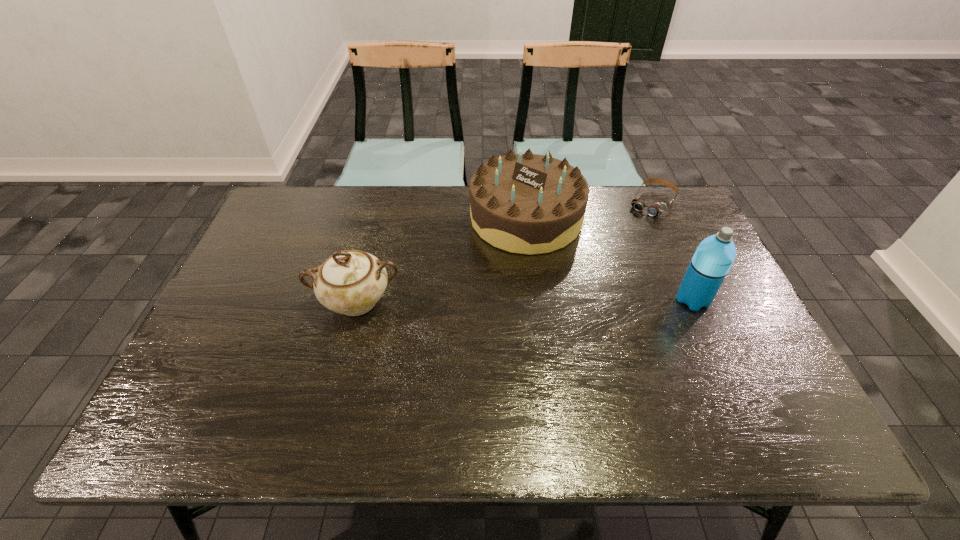
In the image, there is a desktop. Where is `vacant space at the far left corner`? The width and height of the screenshot is (960, 540). vacant space at the far left corner is located at coordinates (305, 218).

Image resolution: width=960 pixels, height=540 pixels. I want to click on free space at the far right corner of the desktop, so click(x=661, y=215).

Identify the location of blank region between the tallest object and the shortest object. The image size is (960, 540). (672, 251).

Locate an element on the screen. This screenshot has height=540, width=960. free spot between the leftmost object and the tallest object is located at coordinates (524, 301).

Identify the location of free space between the birthday cake and the shortest object. [x=588, y=210].

Locate an element on the screen. vacant area that lies between the third object from right to left and the shortest object is located at coordinates (588, 210).

The image size is (960, 540). In order to click on free spot between the leftmost object and the second object from left to right in this screenshot , I will do `click(442, 260)`.

The image size is (960, 540). Identify the location of unoccupied area between the leftmost object and the third object from right to left. (442, 260).

This screenshot has width=960, height=540. In order to click on vacant space that's between the third object from right to left and the leftmost object in this screenshot , I will do `click(442, 260)`.

Find the location of a particular element. The image size is (960, 540). vacant space that's between the goggles and the chinaware is located at coordinates (504, 252).